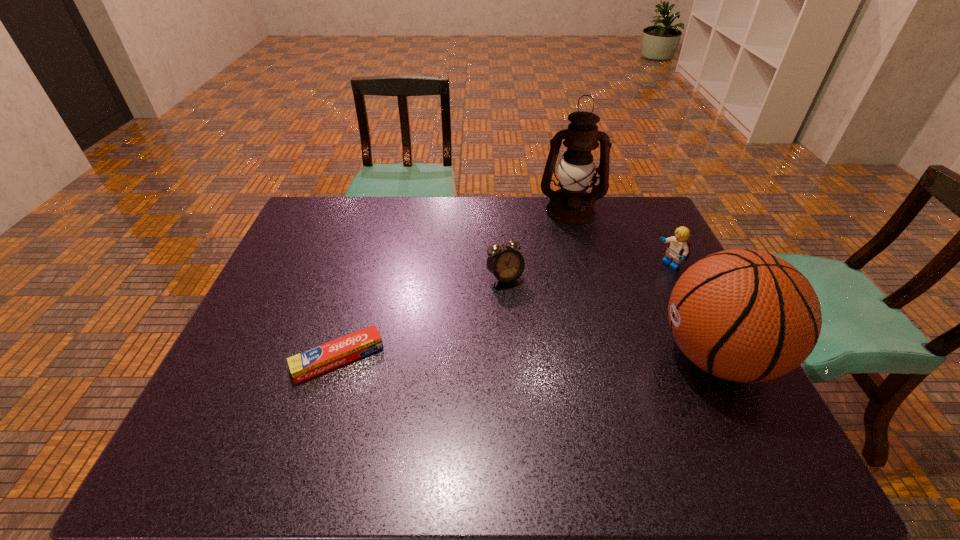
The image size is (960, 540). In order to click on free space located 0.360m on the side where the inflation valve is located in this screenshot , I will do `click(507, 356)`.

Find the location of a particular element. Image resolution: width=960 pixels, height=540 pixels. vacant point located 0.290m on the face of the alarm clock is located at coordinates point(563,367).

Identify the location of vacant region located on the face of the alarm clock. This screenshot has width=960, height=540. (524, 307).

At what (x,y) coordinates should I click in order to perform the action: click on free region located on the face of the alarm clock. Please return your answer as a coordinate pair (x, y). The height and width of the screenshot is (540, 960). Looking at the image, I should click on (543, 337).

The height and width of the screenshot is (540, 960). I want to click on vacant area situated 0.100m on the side of the tallest object, there is a wick adjustment knob, so click(571, 244).

Image resolution: width=960 pixels, height=540 pixels. I want to click on vacant space located on the side of the tallest object, there is a wick adjustment knob, so click(571, 260).

Locate an element on the screen. This screenshot has height=540, width=960. free space located on the side of the tallest object, there is a wick adjustment knob is located at coordinates (570, 234).

Identify the location of vacant space located on the front-facing side of the Lego. (570, 315).

Locate an element on the screen. This screenshot has width=960, height=540. vacant space located on the front-facing side of the Lego is located at coordinates (624, 287).

Image resolution: width=960 pixels, height=540 pixels. I want to click on vacant space located on the front-facing side of the Lego, so [634, 281].